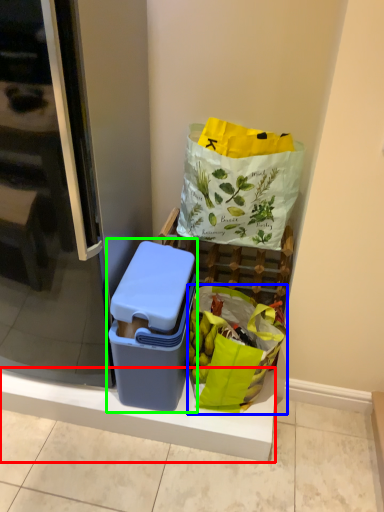
Question: Considering the real-world distances, which object is farthest from balustrade (highlighted by a red box)? grocery bag (highlighted by a blue box) or lunch box (highlighted by a green box)?

Choices:
 (A) grocery bag
 (B) lunch box

Answer: (B)